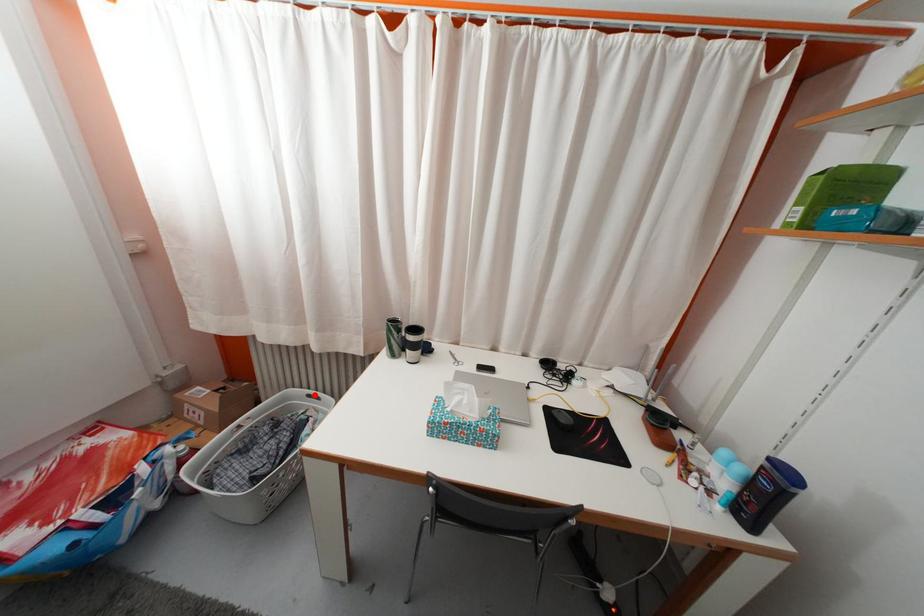
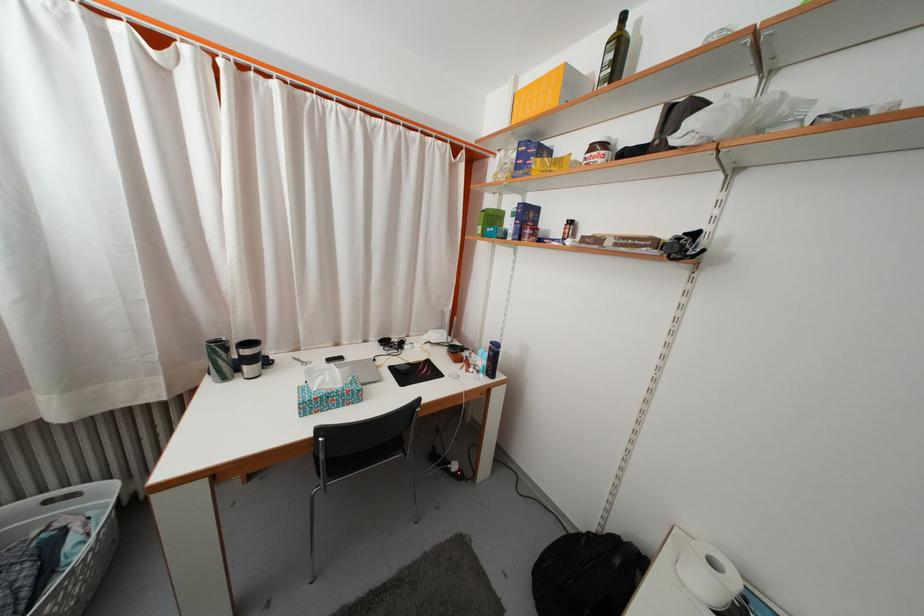
The point at the highlighted location is marked in the first image. Where is the corresponding point in the second image?

(49, 498)